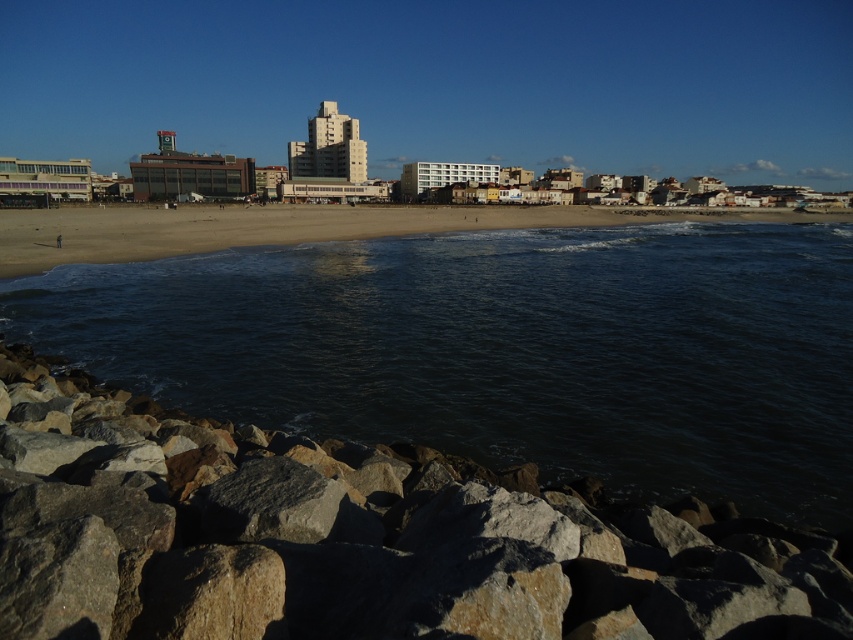
You are standing on the rough textured rock at lower left and want to reach the dark water at center. Based on the scene description, which direction should you move to get to the water?

The dark water at center is much taller than the rough textured rock at lower left, so you should move towards the center to reach the dark water at center.